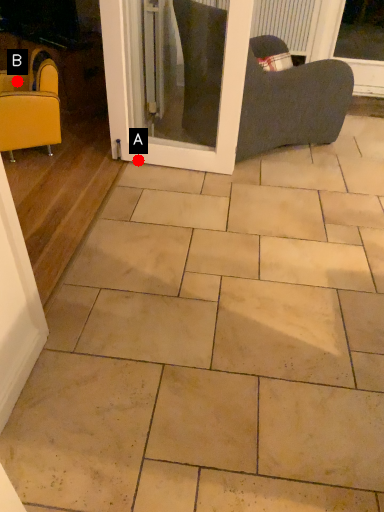
Question: Two points are circled on the image, labeled by A and B beside each circle. Which point appears closest to the camera in this image?

Choices:
 (A) A is closer
 (B) B is closer

Answer: (A)